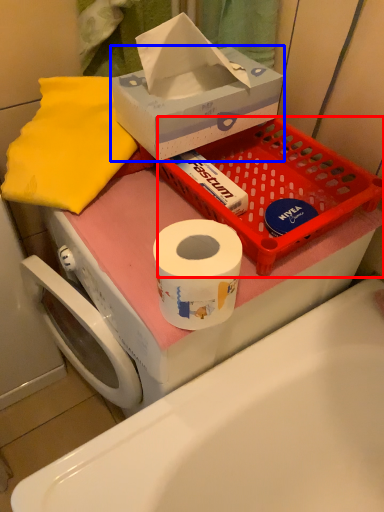
Question: Which object appears closest to the camera in this image, basket (highlighted by a red box) or box (highlighted by a blue box)?

Choices:
 (A) basket
 (B) box

Answer: (B)